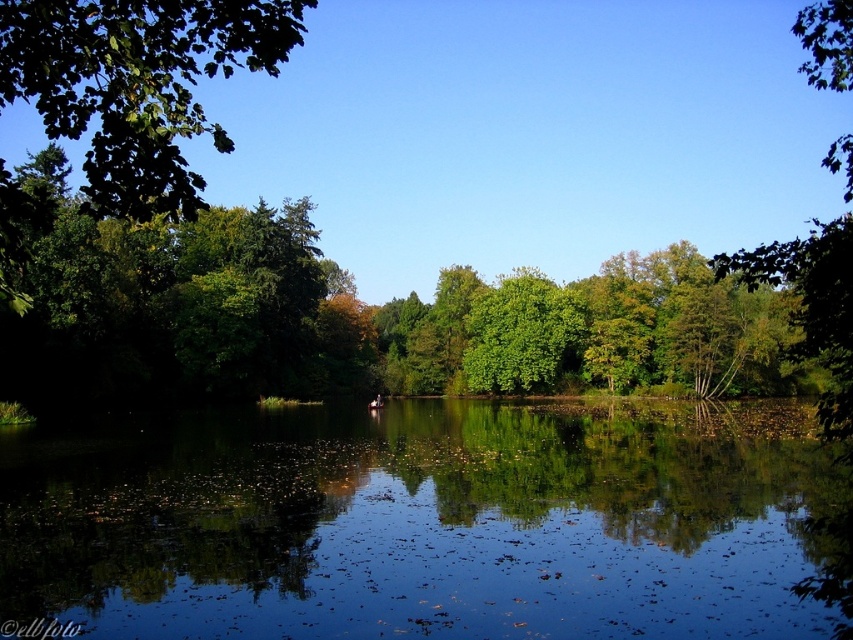
You are standing at the edge of the water and want to walk towards the green leafy tree at center and the green leafy tree at upper left. Which tree will you reach first?

The green leafy tree at center is closer to the viewer than the green leafy tree at upper left, so you will reach the green leafy tree at center first.

You are standing at the edge of the lake and see the green leafy tree at center and the green leafy tree at upper left. Which tree is closer to the water?

The green leafy tree at center is closer to the water because it is positioned below the green leafy tree at upper left.